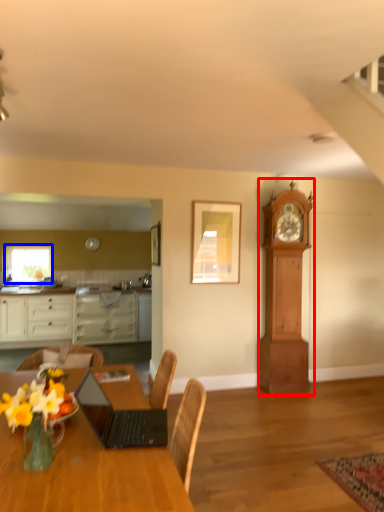
Question: Among these objects, which one is farthest to the camera, clock (highlighted by a red box) or window (highlighted by a blue box)?

Choices:
 (A) clock
 (B) window

Answer: (B)